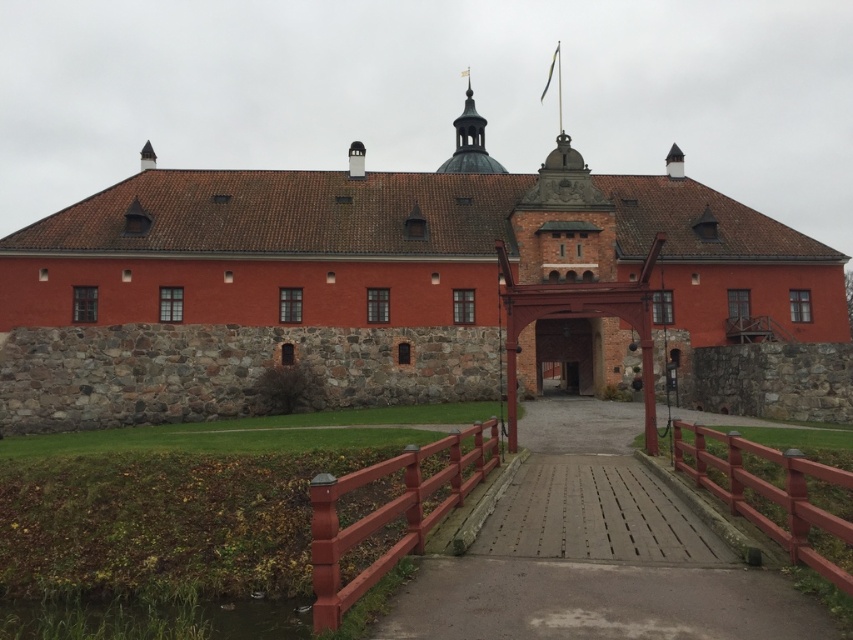
You are a visitor approaching the red brick castle at center and the brown wooden gate at center. Which one is located to the left from your perspective?

The red brick castle at center is positioned on the left side of brown wooden gate at center, so from your perspective, the red brick castle at center is to the left of the brown wooden gate at center.

Looking at this image, you are standing at the point marked by point (413, 248). Looking towards the red brick castle at center, which direction should you walk to reach the red wooden gate?

The point (413, 248) marks the red brick castle at center. To reach the red wooden gate, you should walk away from the castle towards the entrance pathway leading to the gate.